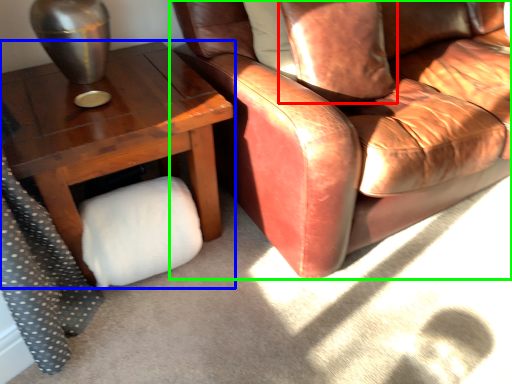
Question: Considering the real-world distances, which object is closest to pillow (highlighted by a red box)? table (highlighted by a blue box) or chair (highlighted by a green box).

Choices:
 (A) table
 (B) chair

Answer: (B)